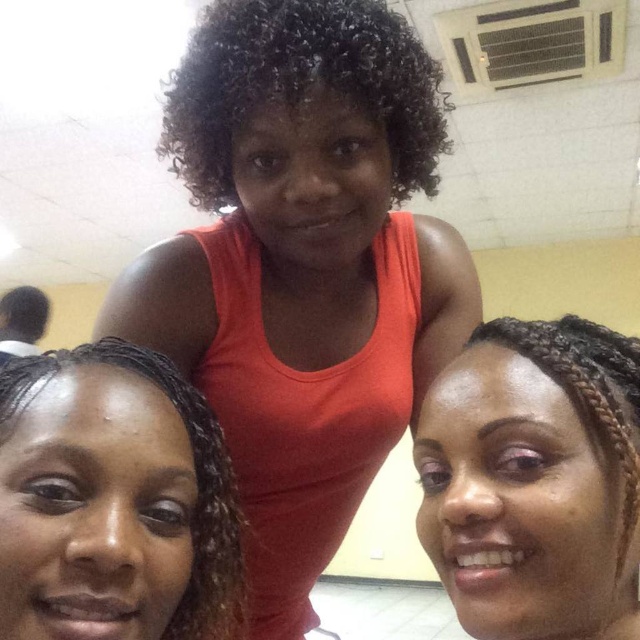
Is the position of black braided hair at lower left less distant than that of black braided hair at lower right?

Yes, black braided hair at lower left is closer to the viewer.

Who is higher up, black braided hair at lower left or black braided hair at lower right?

Positioned higher is black braided hair at lower right.

Locate an element on the screen. The image size is (640, 640). black braided hair at lower left is located at coordinates (113, 500).

Between orange matte tank top at center and black braided hair at lower left, which one appears on the right side from the viewer's perspective?

From the viewer's perspective, orange matte tank top at center appears more on the right side.

Does orange matte tank top at center appear on the right side of black braided hair at lower left?

Correct, you'll find orange matte tank top at center to the right of black braided hair at lower left.

At what (x,y) coordinates should I click in order to perform the action: click on orange matte tank top at center. Please return your answer as a coordinate pair (x, y). Looking at the image, I should click on (304, 266).

Which is more to the right, black braided hair at lower left or curly dark brown hair at center?

Positioned to the right is curly dark brown hair at center.

Does black braided hair at lower left have a greater width compared to curly dark brown hair at center?

No.

Find the location of `black braided hair at lower left`. black braided hair at lower left is located at coordinates (113, 500).

Identify the location of black braided hair at lower left. (113, 500).